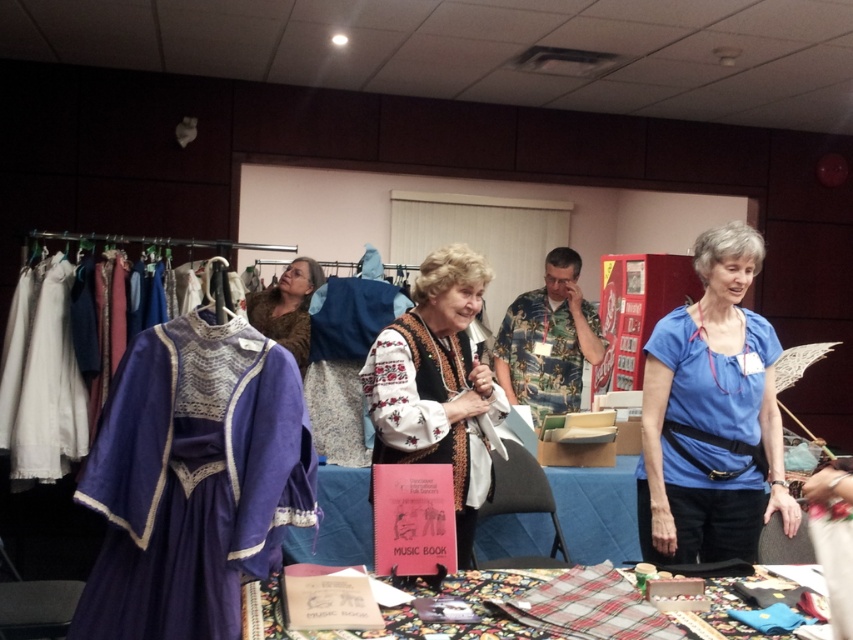
You are organizing a clothing donation drive and need to determine which items can fit into a small donation box. The flannel fabric at lower center and the camouflage fabric shirt at center are both candidates. Based on their sizes, which item is more likely to fit into the small donation box?

The flannel fabric at lower center is smaller than the camouflage fabric shirt at center, so it is more likely to fit into the small donation box.

You are an interior designer arranging items on a table. You have an embroidered fabric vest at center and a camouflage fabric shirt at center. If you want to place them side by side on the table, which one should you place first to ensure there is enough space?

The embroidered fabric vest at center is taller than the camouflage fabric shirt at center, so you should place the embroidered fabric vest at center first to ensure there is enough space.